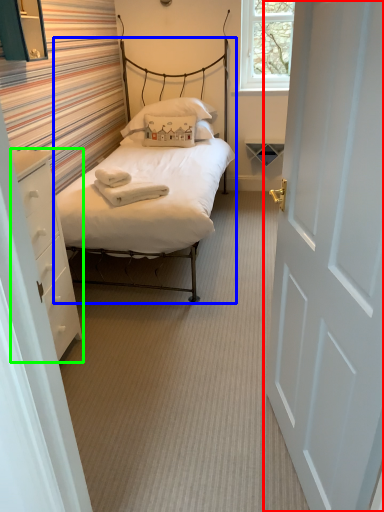
Question: Based on their relative distances, which object is farther from door (highlighted by a red box)? Choose from bed (highlighted by a blue box) and nightstand (highlighted by a green box).

Choices:
 (A) bed
 (B) nightstand

Answer: (A)